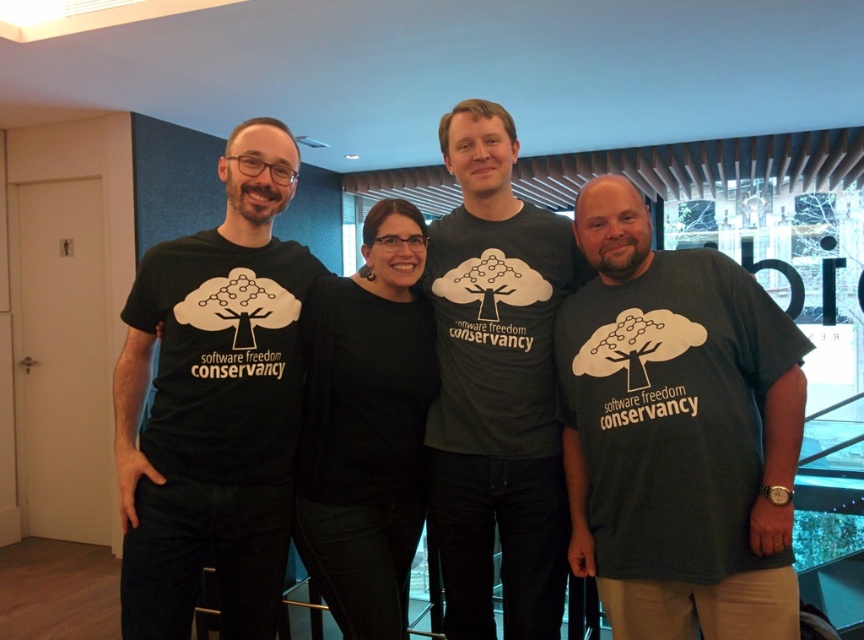
Question: Can you confirm if dark green t-shirt at right is smaller than dark gray t-shirt at center?

Choices:
 (A) yes
 (B) no

Answer: (A)

Question: Is the position of dark green t-shirt at right more distant than that of dark gray t-shirt at center?

Choices:
 (A) no
 (B) yes

Answer: (A)

Question: Is dark gray t-shirt at center positioned behind black matte shirt at center?

Choices:
 (A) yes
 (B) no

Answer: (A)

Question: Which point appears closest to the camera in this image?

Choices:
 (A) (672, 605)
 (B) (542, 380)

Answer: (A)

Question: Which point is closer to the camera taking this photo?

Choices:
 (A) (591, 513)
 (B) (211, 518)
 (C) (480, 452)

Answer: (A)

Question: Which point is farther to the camera?

Choices:
 (A) (315, 403)
 (B) (757, 420)
 (C) (432, 284)

Answer: (C)